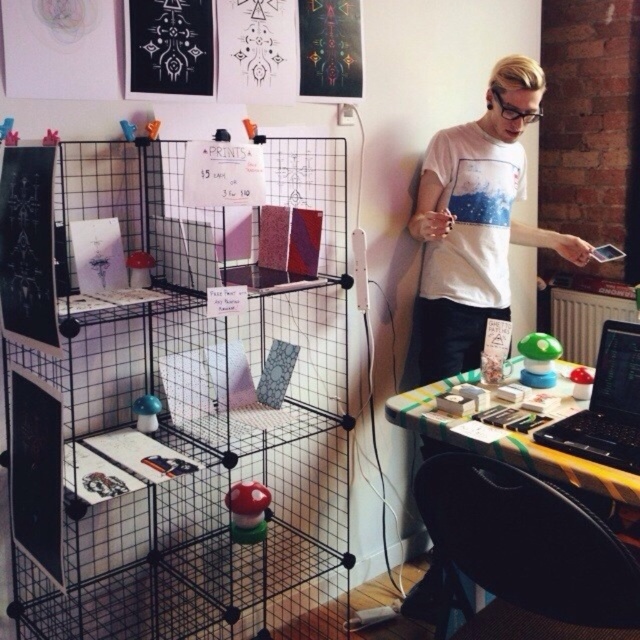
Question: Considering the real-world distances, which object is closest to the black wire mesh cage at center?

Choices:
 (A) white matte t-shirt at center
 (B) black plastic laptop at right
 (C) yellow checkered table at lower right

Answer: (C)

Question: Estimate the real-world distances between objects in this image. Which object is closer to the yellow checkered table at lower right?

Choices:
 (A) white matte t-shirt at center
 (B) black plastic laptop at right

Answer: (B)

Question: From the image, what is the correct spatial relationship of black wire mesh cage at center in relation to yellow checkered table at lower right?

Choices:
 (A) right
 (B) left

Answer: (B)

Question: Is black wire mesh cage at center positioned behind yellow checkered table at lower right?

Choices:
 (A) no
 (B) yes

Answer: (A)

Question: Among these objects, which one is farthest from the camera?

Choices:
 (A) black wire mesh cage at center
 (B) yellow checkered table at lower right
 (C) black plastic laptop at right
 (D) white matte t-shirt at center

Answer: (D)

Question: Is black wire mesh cage at center positioned behind yellow checkered table at lower right?

Choices:
 (A) yes
 (B) no

Answer: (B)